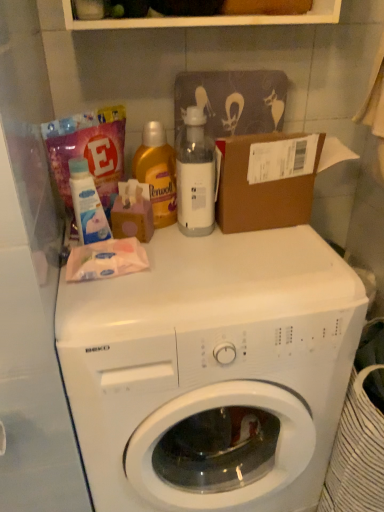
Locate an element on the screen. This screenshot has width=384, height=512. free point in front of white plastic bottle at center is located at coordinates click(x=202, y=263).